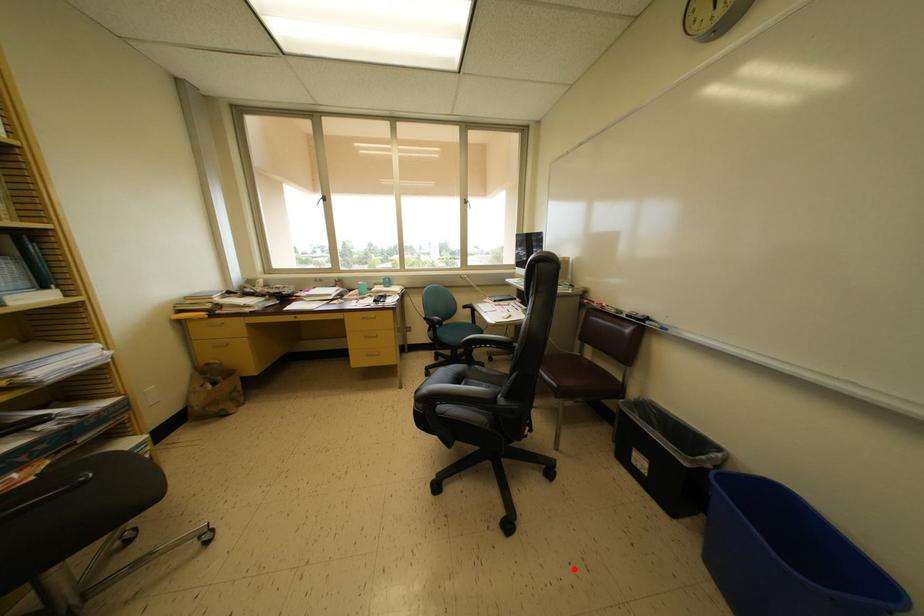
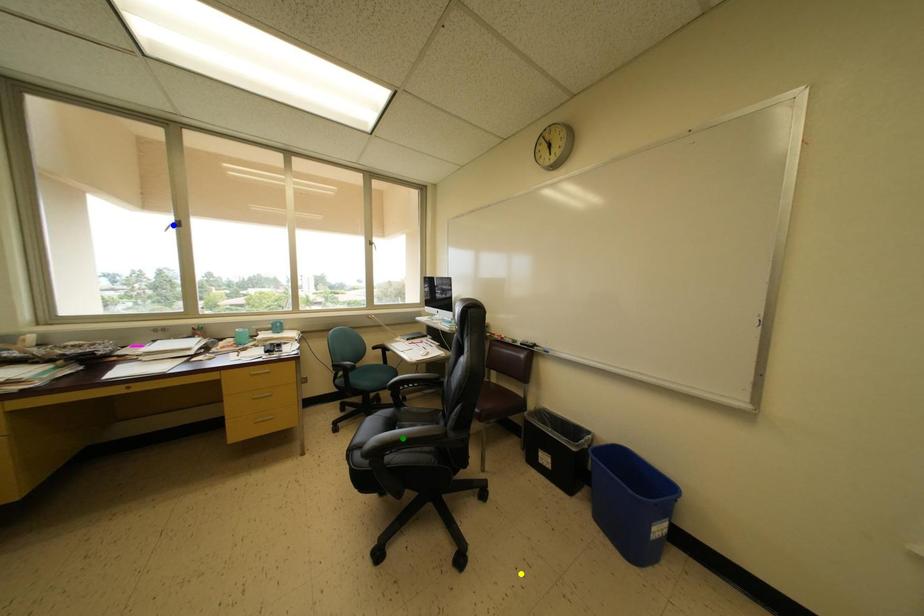
Question: I am providing you with two images of the same scene from different viewpoints. A red point is marked on the first image. You are given multiple points on the second image. Which point in image 2 represents the same 3d spot as the red point in image 1?

Choices:
 (A) blue point
 (B) green point
 (C) yellow point

Answer: (C)